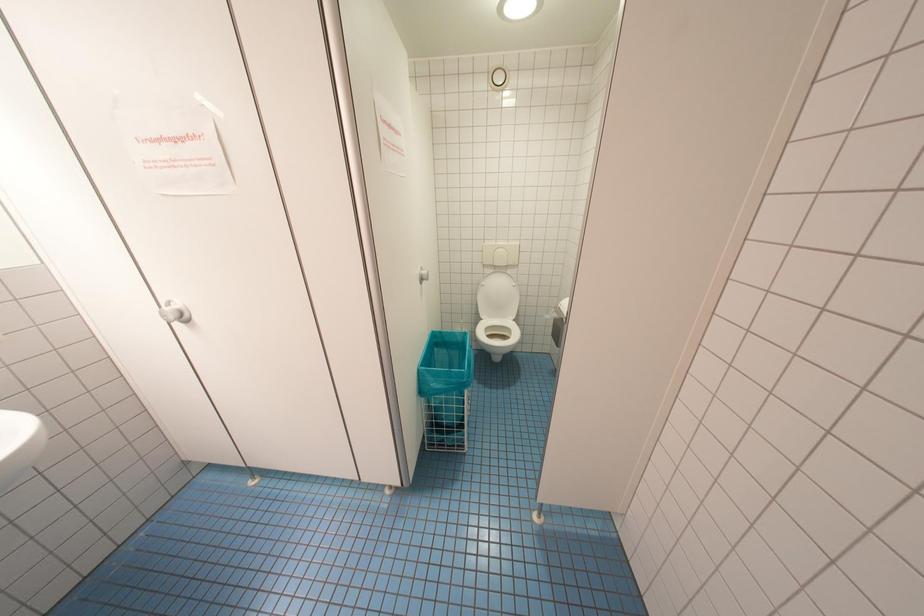
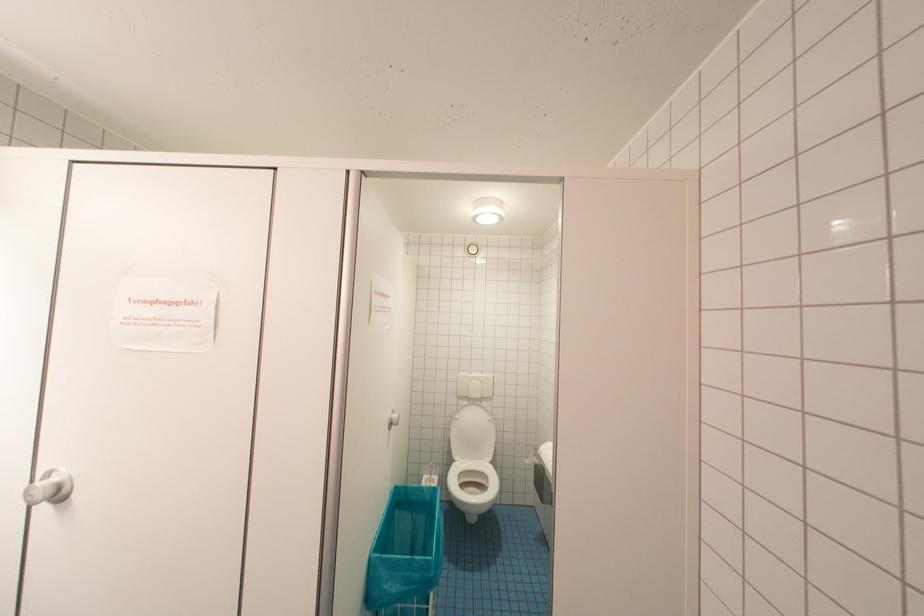
Which direction would the cameraman need to move to produce the second image?

The movement direction of the cameraman is left, backward.